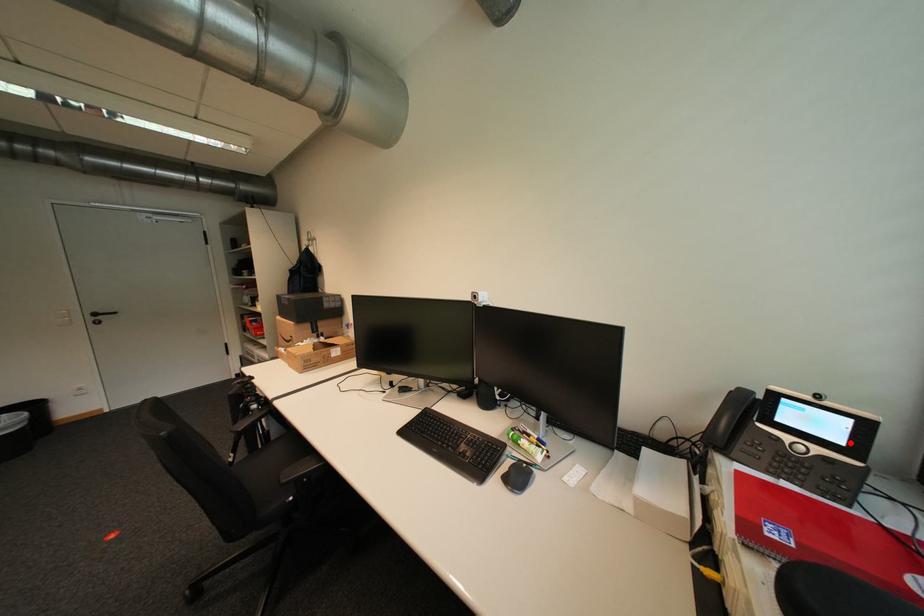
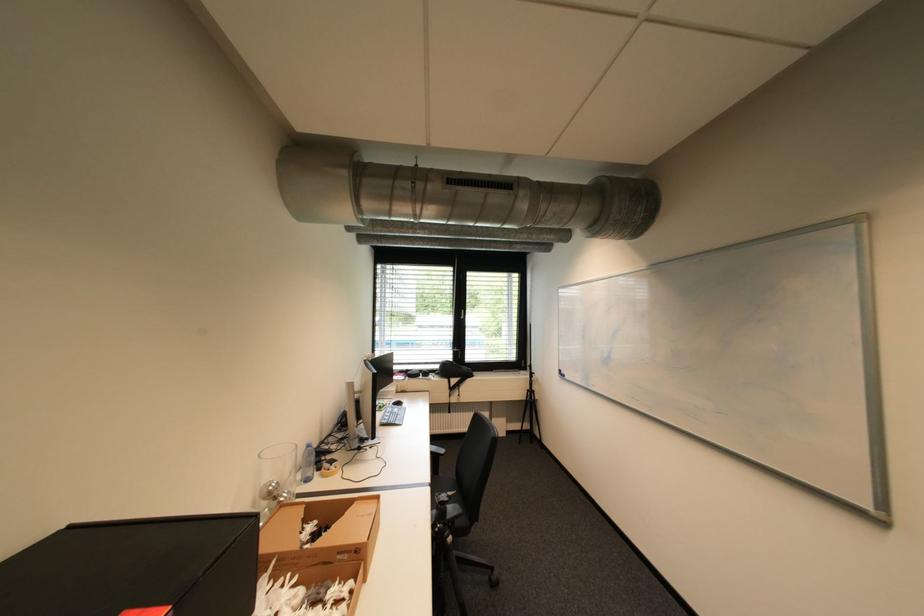
Question: I am providing you with two images of the same scene from different viewpoints. A red point is marked on the first image. Can you still see the location of the red point in image 2?

Choices:
 (A) Yes
 (B) No

Answer: (B)